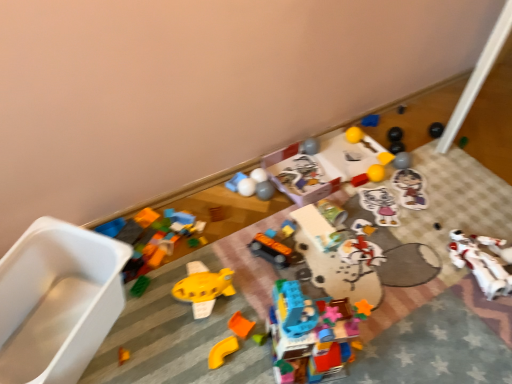
Identify the location of vacant space behind matte black car at center, the eighth toy positioned from the left. (281, 227).